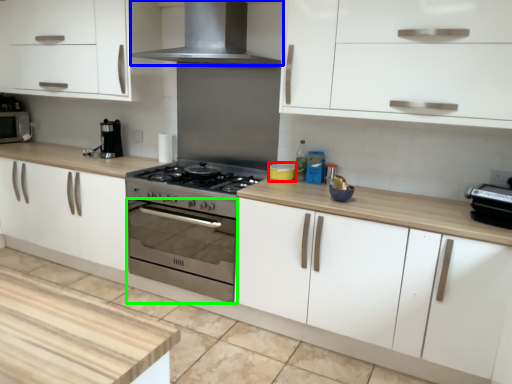
Question: Which object is the farthest from appliance (highlighted by a red box)? Choose among these: home appliance (highlighted by a blue box) or oven (highlighted by a green box).

Choices:
 (A) home appliance
 (B) oven

Answer: (A)